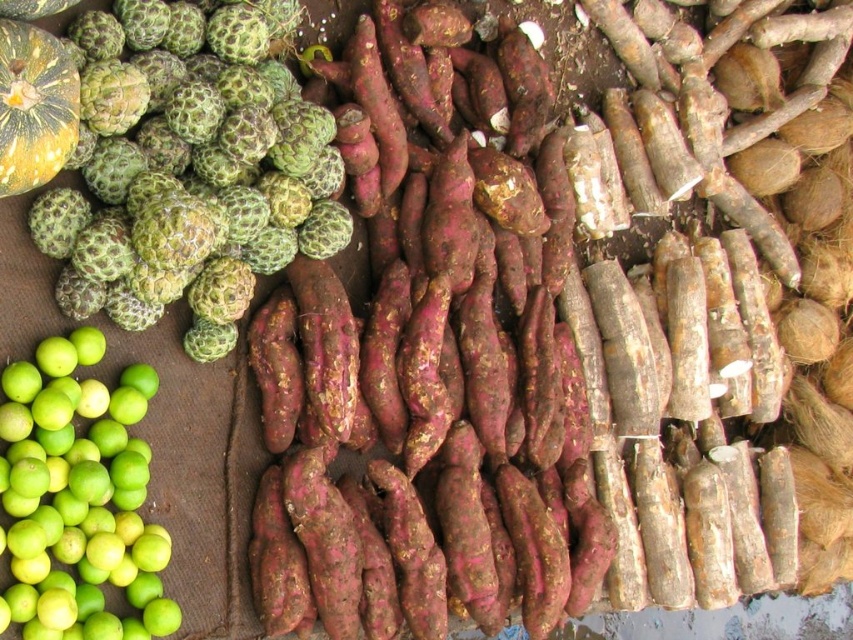
Question: Does green rough textured fruit at upper left appear under green matte lime at lower left?

Choices:
 (A) no
 (B) yes

Answer: (A)

Question: Is green rough textured fruit at upper left further to camera compared to green matte lime at lower left?

Choices:
 (A) no
 (B) yes

Answer: (A)

Question: Is green rough textured fruit at upper left above green matte lime at lower left?

Choices:
 (A) yes
 (B) no

Answer: (A)

Question: Which object appears closest to the camera in this image?

Choices:
 (A) green rough textured fruit at upper left
 (B) green matte lime at lower left

Answer: (A)

Question: Which point is farther to the camera?

Choices:
 (A) green rough textured fruit at upper left
 (B) green matte lime at lower left

Answer: (B)